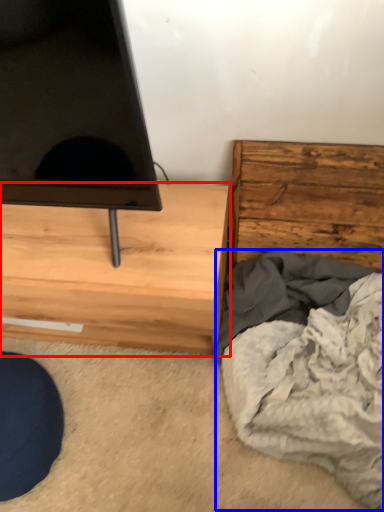
Question: Which object appears closest to the camera in this image, chest of drawers (highlighted by a red box) or blanket (highlighted by a blue box)?

Choices:
 (A) chest of drawers
 (B) blanket

Answer: (B)